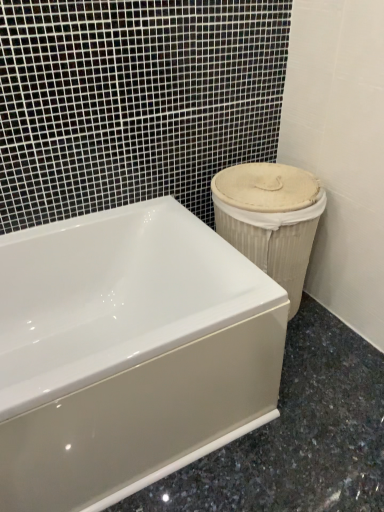
Identify the location of vacant point to the right of white glossy bathtub at center. (305, 416).